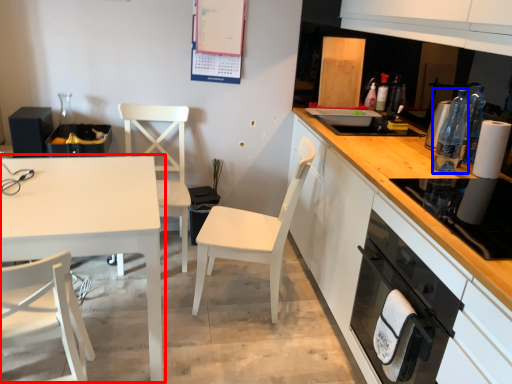
Question: Which object is further to the camera taking this photo, table (highlighted by a red box) or bottle (highlighted by a blue box)?

Choices:
 (A) table
 (B) bottle

Answer: (B)